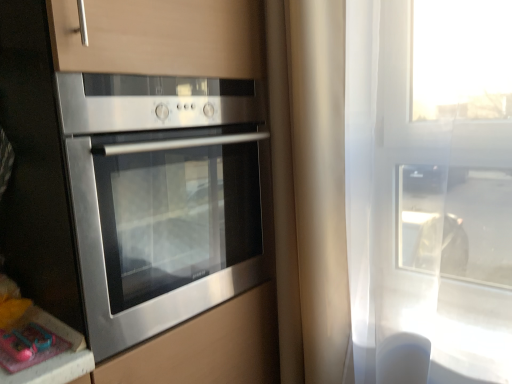
Question: Is stainless steel oven at left inside the boundaries of pink plastic toy at lower left, or outside?

Choices:
 (A) outside
 (B) inside

Answer: (A)

Question: Is stainless steel oven at left in front of or behind pink plastic toy at lower left in the image?

Choices:
 (A) behind
 (B) front

Answer: (B)

Question: In terms of height, does stainless steel oven at left look taller or shorter compared to pink plastic toy at lower left?

Choices:
 (A) short
 (B) tall

Answer: (B)

Question: Relative to stainless steel oven at left, is pink plastic toy at lower left in front or behind?

Choices:
 (A) front
 (B) behind

Answer: (B)

Question: From a real-world perspective, relative to stainless steel oven at left, is pink plastic toy at lower left vertically above or below?

Choices:
 (A) below
 (B) above

Answer: (A)

Question: Is pink plastic toy at lower left inside or outside of stainless steel oven at left?

Choices:
 (A) outside
 (B) inside

Answer: (A)

Question: Considering the relative positions of pink plastic toy at lower left and stainless steel oven at left in the image provided, is pink plastic toy at lower left to the left or to the right of stainless steel oven at left?

Choices:
 (A) right
 (B) left

Answer: (B)